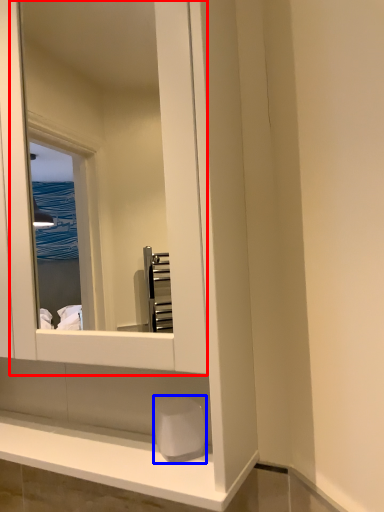
Question: Among these objects, which one is nearest to the camera, mirror (highlighted by a red box) or soap (highlighted by a blue box)?

Choices:
 (A) mirror
 (B) soap

Answer: (A)